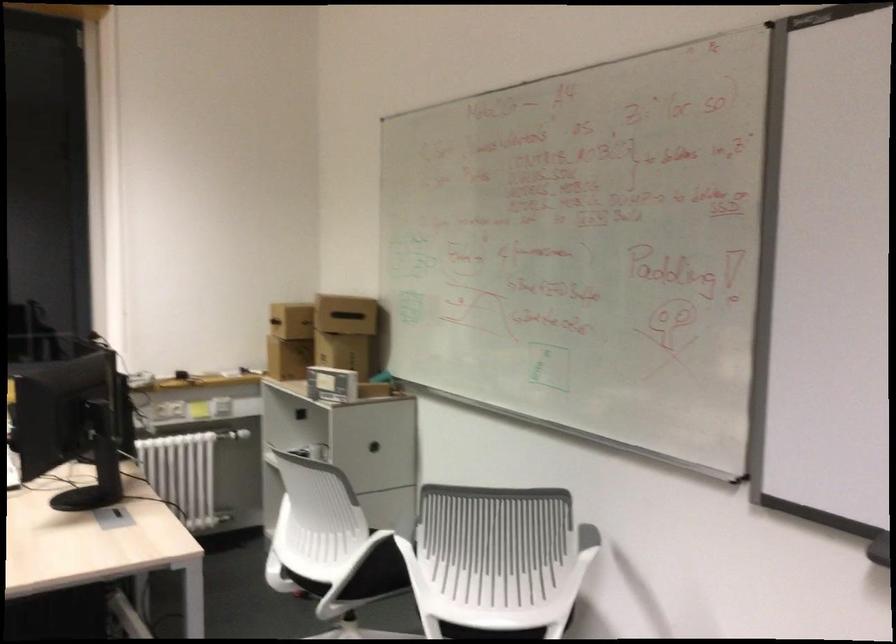
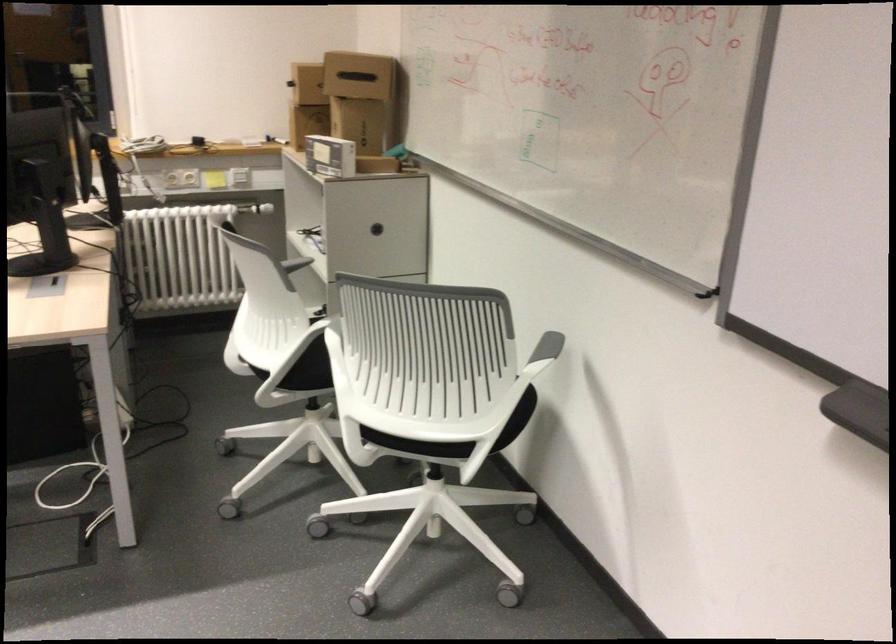
Find the pixel in the second image that matches [584,536] in the first image.

(547, 346)